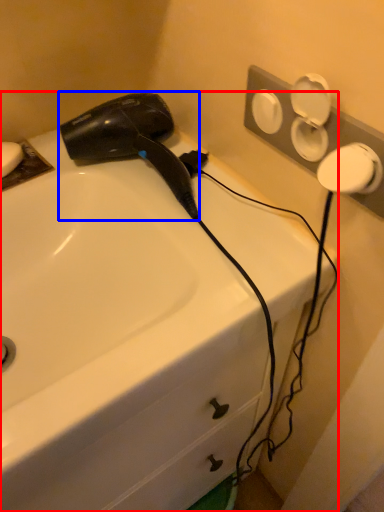
Question: Which of the following is the farthest to the observer, sink (highlighted by a red box) or hair drier (highlighted by a blue box)?

Choices:
 (A) sink
 (B) hair drier

Answer: (B)